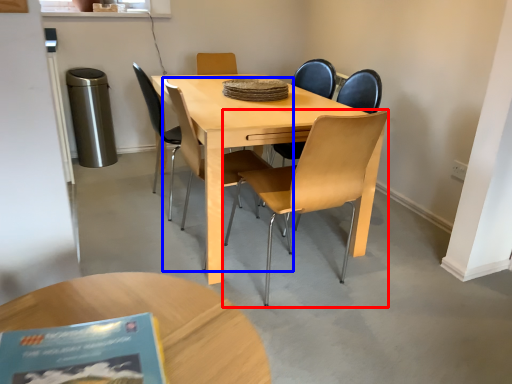
Question: Which object appears farthest to the camera in this image, chair (highlighted by a red box) or chair (highlighted by a blue box)?

Choices:
 (A) chair
 (B) chair

Answer: (B)